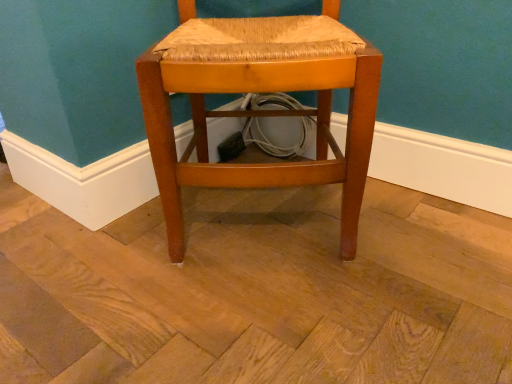
What do you see at coordinates (259, 115) in the screenshot? I see `matte wood chair at center` at bounding box center [259, 115].

Locate an element on the screen. matte wood chair at center is located at coordinates (259, 115).

Where is `matte wood chair at center`? matte wood chair at center is located at coordinates (259, 115).